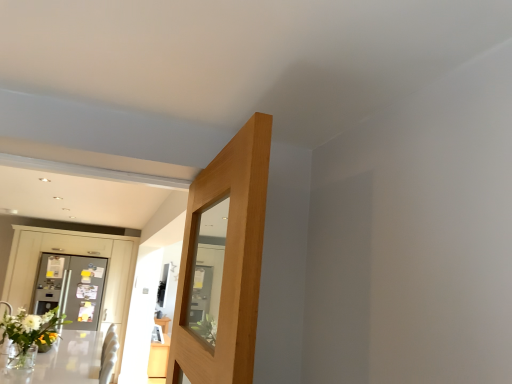
Question: From a real-world perspective, is clear glass table at lower left, which is the 1th table in top-to-bottom order, on metallic gray dresser at left?

Choices:
 (A) yes
 (B) no

Answer: (B)

Question: Is clear glass table at lower left, which is the 1th table in top-to-bottom order, surrounding metallic gray dresser at left?

Choices:
 (A) yes
 (B) no

Answer: (B)

Question: Is clear glass table at lower left, the first table from the front, shorter than metallic gray dresser at left?

Choices:
 (A) yes
 (B) no

Answer: (A)

Question: Considering the relative sizes of clear glass table at lower left, marked as the second table in a back-to-front arrangement, and metallic gray dresser at left in the image provided, is clear glass table at lower left, marked as the second table in a back-to-front arrangement, taller than metallic gray dresser at left?

Choices:
 (A) yes
 (B) no

Answer: (B)

Question: Is clear glass table at lower left, which is the 1th table in top-to-bottom order, at the left side of metallic gray dresser at left?

Choices:
 (A) yes
 (B) no

Answer: (B)

Question: Do you think clear glass table at lower left, marked as the second table in a back-to-front arrangement, is within metallic gray dresser at left, or outside of it?

Choices:
 (A) outside
 (B) inside

Answer: (A)

Question: From the image's perspective, is clear glass table at lower left, which is the 1th table in top-to-bottom order, located above or below metallic gray dresser at left?

Choices:
 (A) below
 (B) above

Answer: (A)

Question: Based on their sizes in the image, would you say clear glass table at lower left, marked as the second table in a back-to-front arrangement, is bigger or smaller than metallic gray dresser at left?

Choices:
 (A) big
 (B) small

Answer: (B)

Question: From a real-world perspective, is clear glass table at lower left, placed as the second table when sorted from bottom to top, positioned above or below metallic gray dresser at left?

Choices:
 (A) below
 (B) above

Answer: (A)

Question: From their relative heights in the image, would you say metallic silver refrigerator at left is taller or shorter than metallic gray dresser at left?

Choices:
 (A) short
 (B) tall

Answer: (A)

Question: Considering their positions, is metallic silver refrigerator at left located in front of or behind metallic gray dresser at left?

Choices:
 (A) front
 (B) behind

Answer: (B)

Question: Does point (39, 304) appear closer or farther from the camera than point (10, 261)?

Choices:
 (A) farther
 (B) closer

Answer: (A)

Question: From a real-world perspective, relative to metallic gray dresser at left, is metallic silver refrigerator at left vertically above or below?

Choices:
 (A) above
 (B) below

Answer: (B)

Question: Choose the correct answer: Is metallic gray dresser at left inside clear glass table at lower left, the first table from the front, or outside it?

Choices:
 (A) inside
 (B) outside

Answer: (B)

Question: Is point (128, 306) closer or farther from the camera than point (65, 334)?

Choices:
 (A) closer
 (B) farther

Answer: (B)